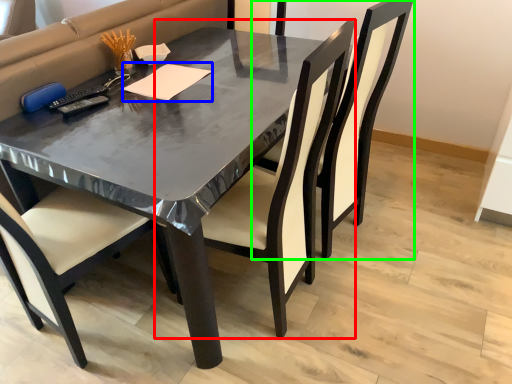
Question: Which object is the closest to the chair (highlighted by a red box)? Choose among these: notepad (highlighted by a blue box) or chair (highlighted by a green box).

Choices:
 (A) notepad
 (B) chair

Answer: (B)